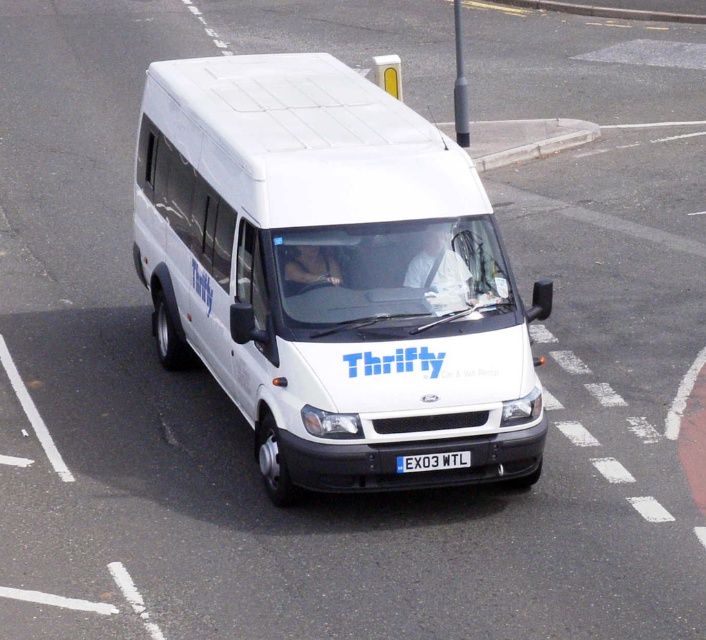
You are a delivery driver who needs to park your white matte van at center in a specific spot. The parking spot you need is at coordinates point A, which is at position 0.5, 0.5. Is your van currently positioned closer to point A than to the edge of the parking lot?

The white matte van at center is located at point (333, 275), which is very close to the desired point A at (353, 320). Since the coordinates are nearly the same, the van is indeed positioned closer to point A than to the edge of the parking lot.

You are a delivery driver who needs to park your white matte van at center in a tight space. There is a white plastic license plate at center in front of you. Which side of the license plate should you position your van to avoid collision?

The white matte van at center should be positioned to the left of the white plastic license plate at center to avoid collision since the van is already to the left of the license plate according to the description.